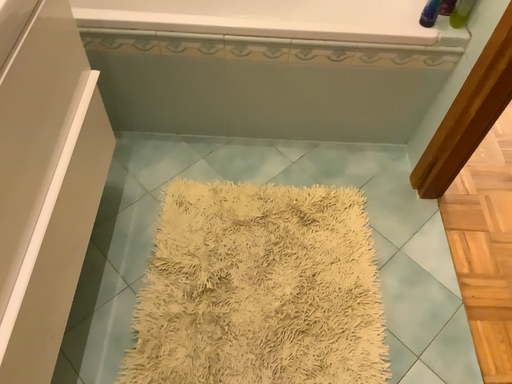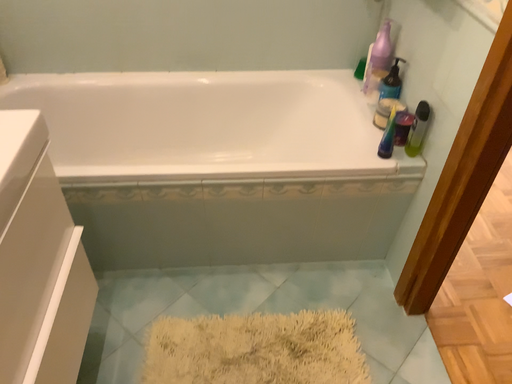
Question: How did the camera likely rotate when shooting the video?

Choices:
 (A) rotated upward
 (B) rotated downward

Answer: (A)